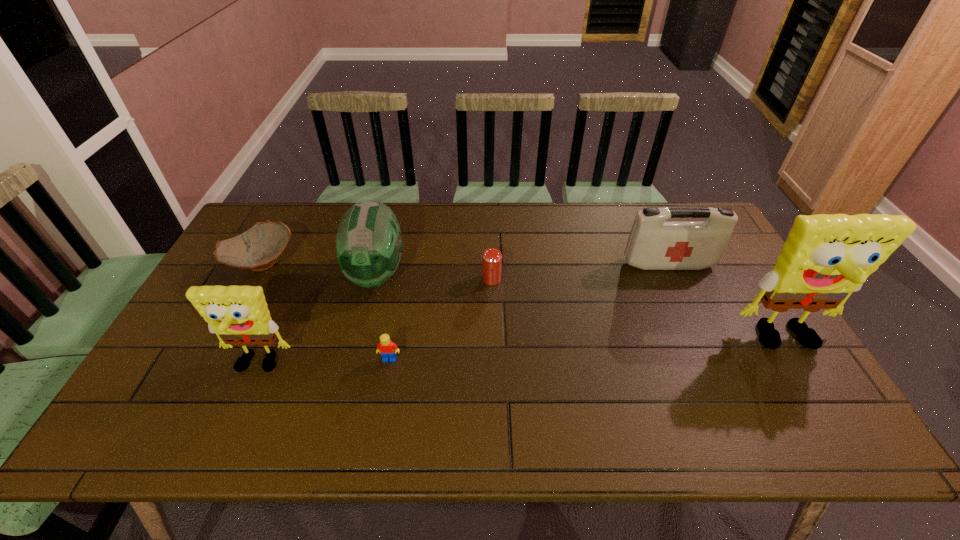
Image resolution: width=960 pixels, height=540 pixels. I want to click on unoccupied area between the Lego and the pottery, so click(x=325, y=311).

The width and height of the screenshot is (960, 540). Identify the location of vacant area that lies between the shorter sponge and the football helmet. (317, 320).

The height and width of the screenshot is (540, 960). In order to click on unoccupied area between the Lego and the football helmet in this screenshot , I will do `click(383, 316)`.

Find the location of `vacant point located between the tallest object and the beer can`. vacant point located between the tallest object and the beer can is located at coordinates (639, 310).

Identify the location of unoccupied position between the beer can and the Lego. Image resolution: width=960 pixels, height=540 pixels. (441, 319).

Identify the location of vacant area between the beer can and the football helmet. (434, 276).

Image resolution: width=960 pixels, height=540 pixels. What are the coordinates of `the fifth closest object to the pottery` in the screenshot? It's located at (654, 244).

Where is `the sixth closest object to the pottery`? Image resolution: width=960 pixels, height=540 pixels. the sixth closest object to the pottery is located at coordinates (825, 258).

At what (x,y) coordinates should I click in order to perform the action: click on vacant region that satisfies the following two spatial constraints: 1. on the visor of the football helmet; 2. on the right side of the beer can. Please return your answer as a coordinate pair (x, y). The image size is (960, 540). Looking at the image, I should click on (375, 279).

Locate an element on the screen. The height and width of the screenshot is (540, 960). vacant space that satisfies the following two spatial constraints: 1. on the visor of the fifth object from left to right; 2. on the left side of the football helmet is located at coordinates (375, 279).